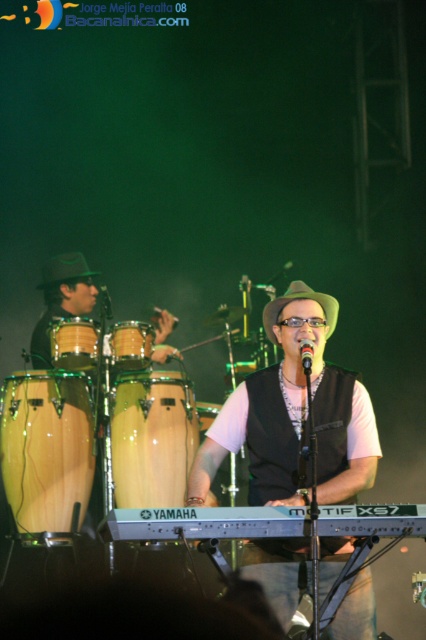
Is natural wood conga at center bigger than green felt hat at left?

Yes.

Is point (14, 508) positioned behind point (85, 262)?

No, it is in front of (85, 262).

Where is `natural wood conga at center`? natural wood conga at center is located at coordinates point(46,449).

Which is above, light brown wood conga at center or wooden conga drum at left?

wooden conga drum at left is higher up.

Between light brown wood conga at center and wooden conga drum at left, which one has more height?

light brown wood conga at center is taller.

Between point (176, 486) and point (68, 356), which one is positioned in front?

Point (68, 356)

Identify the location of light brown wood conga at center. The height and width of the screenshot is (640, 426). (152, 436).

Is point (307, 344) less distant than point (101, 305)?

Yes.

Can you confirm if black matte microphone at center is wider than wooden drum at left?

In fact, black matte microphone at center might be narrower than wooden drum at left.

Is point (305, 360) behind point (100, 284)?

No, (305, 360) is in front of (100, 284).

This screenshot has width=426, height=640. I want to click on black matte microphone at center, so click(307, 355).